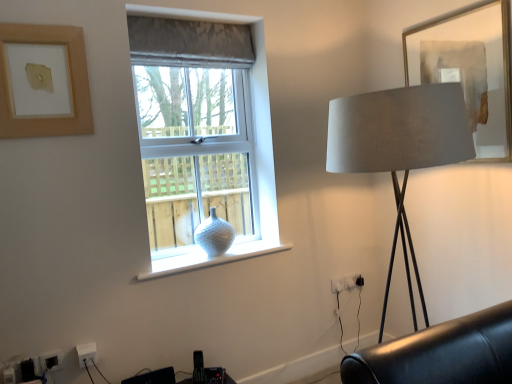
Question: Can satin beige lampshade at right be found inside white plastic electric outlet at lower right, arranged as the 1th electric outlet when viewed from the back?

Choices:
 (A) no
 (B) yes

Answer: (A)

Question: Does white plastic electric outlet at lower right, positioned as the first electric outlet in top-to-bottom order, have a lesser width compared to satin beige lampshade at right?

Choices:
 (A) no
 (B) yes

Answer: (B)

Question: Is white plastic electric outlet at lower right, positioned as the first electric outlet in right-to-left order, to the left of satin beige lampshade at right from the viewer's perspective?

Choices:
 (A) no
 (B) yes

Answer: (B)

Question: From a real-world perspective, is white plastic electric outlet at lower right, placed as the third electric outlet when sorted from left to right, positioned over satin beige lampshade at right based on gravity?

Choices:
 (A) yes
 (B) no

Answer: (B)

Question: Can we say white plastic electric outlet at lower right, positioned as the first electric outlet in top-to-bottom order, lies outside satin beige lampshade at right?

Choices:
 (A) yes
 (B) no

Answer: (A)

Question: Relative to white glossy vase at window, is gray textured fabric curtain at upper center in front or behind?

Choices:
 (A) behind
 (B) front

Answer: (B)

Question: From the image's perspective, is gray textured fabric curtain at upper center above or below white glossy vase at window?

Choices:
 (A) below
 (B) above

Answer: (B)

Question: Visually, is gray textured fabric curtain at upper center positioned to the left or to the right of white glossy vase at window?

Choices:
 (A) left
 (B) right

Answer: (A)

Question: From a real-world perspective, is gray textured fabric curtain at upper center above or below white glossy vase at window?

Choices:
 (A) above
 (B) below

Answer: (A)

Question: In terms of width, does white plastic electric outlet at lower right, acting as the 2th electric outlet starting from the left, look wider or thinner when compared to white glossy vase at center?

Choices:
 (A) wide
 (B) thin

Answer: (B)

Question: From the image's perspective, is white plastic electric outlet at lower right, placed as the second electric outlet when sorted from back to front, located above or below white glossy vase at center?

Choices:
 (A) above
 (B) below

Answer: (B)

Question: From a real-world perspective, is white plastic electric outlet at lower right, the 2th electric outlet in the bottom-to-top sequence, above or below white glossy vase at center?

Choices:
 (A) below
 (B) above

Answer: (A)

Question: Is white plastic electric outlet at lower right, placed as the second electric outlet when sorted from back to front, bigger or smaller than white glossy vase at center?

Choices:
 (A) big
 (B) small

Answer: (B)

Question: Based on their sizes in the image, would you say white plastic electric outlet at lower right, the 2th electric outlet in the bottom-to-top sequence, is bigger or smaller than white textured vase at center?

Choices:
 (A) small
 (B) big

Answer: (A)

Question: Does point (336, 283) appear closer or farther from the camera than point (261, 200)?

Choices:
 (A) farther
 (B) closer

Answer: (A)